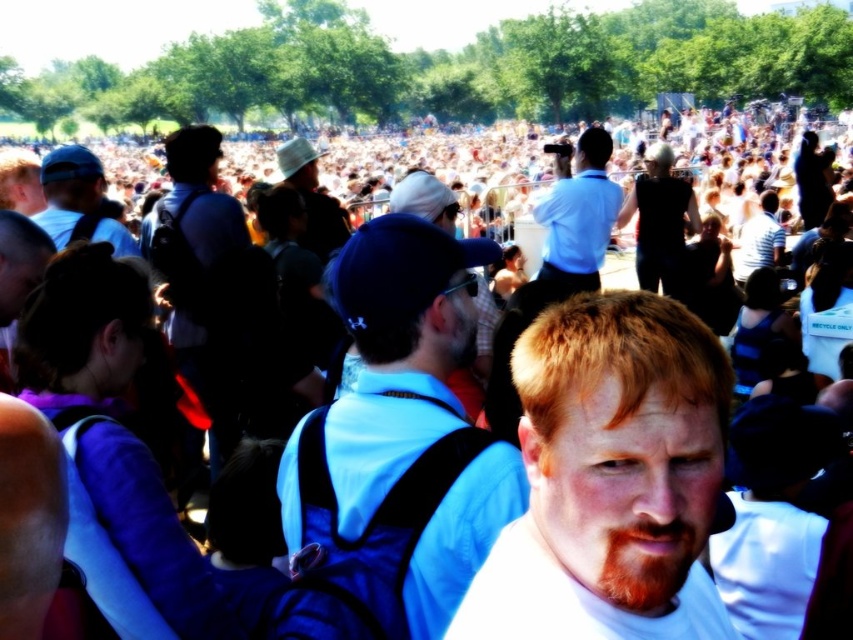
You are standing at the center of the image and want to find the light brown hair at center. According to the coordinates provided, in which direction should you look to locate it?

The light brown hair at center is located at coordinates point (610, 477), so you should look to the lower right direction from the center to locate it.

You are attending an outdoor event and want to take a photo of the striped shirt at center without the matte blue cap at upper left blocking the view. Is there a way to adjust your position to achieve this?

The matte blue cap at upper left is in front of the striped shirt at center, so moving to a position where you can see the striped shirt at center but not the matte blue cap at upper left would require shifting your viewpoint to the side or behind the matte blue cap at upper left.